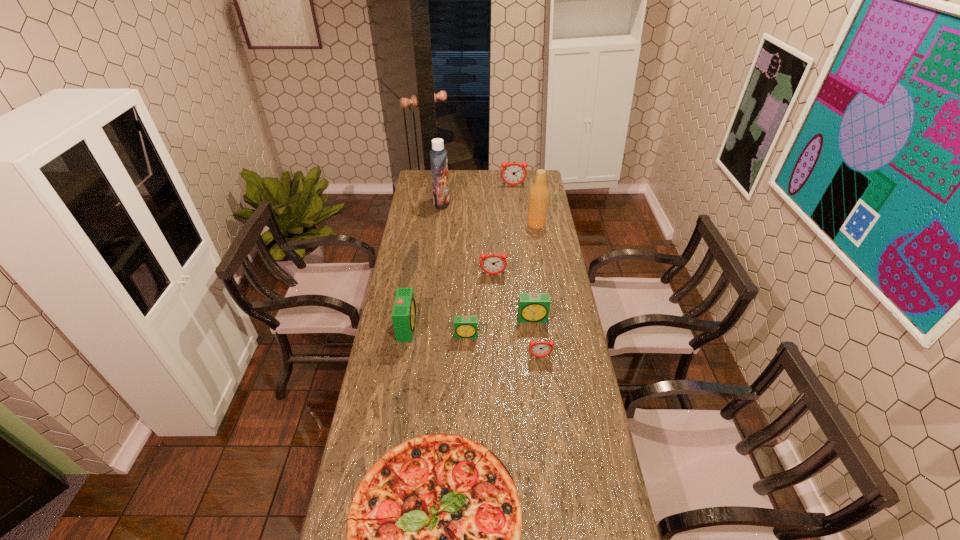
At what (x,y) coordinates should I click in order to perform the action: click on the rightmost green alarm clock. Please return your answer as a coordinate pair (x, y). The width and height of the screenshot is (960, 540). Looking at the image, I should click on (532, 307).

Locate an element on the screen. Image resolution: width=960 pixels, height=540 pixels. the second nearest object is located at coordinates (541, 348).

What are the coordinates of `the nearest reddish-pink alarm clock` in the screenshot? It's located at (541, 348).

I want to click on the fifth alarm clock from right to left, so click(464, 326).

Where is `the second green alarm clock from left to right`? The width and height of the screenshot is (960, 540). the second green alarm clock from left to right is located at coordinates (464, 326).

Where is `free space located 0.210m on the front label of the second farthest object`? The width and height of the screenshot is (960, 540). free space located 0.210m on the front label of the second farthest object is located at coordinates (489, 203).

Locate an element on the screen. The width and height of the screenshot is (960, 540). vacant region located 0.090m on the left of the tan beer bottle is located at coordinates (509, 224).

Locate an element on the screen. The width and height of the screenshot is (960, 540). free space located 0.050m on the front-facing side of the farthest reddish-pink alarm clock is located at coordinates (514, 192).

I want to click on vacant region located on the front-facing side of the leftmost green alarm clock, so click(x=468, y=327).

The width and height of the screenshot is (960, 540). Find the location of `free space located 0.260m on the front-facing side of the second farthest reddish-pink alarm clock`. free space located 0.260m on the front-facing side of the second farthest reddish-pink alarm clock is located at coordinates (494, 321).